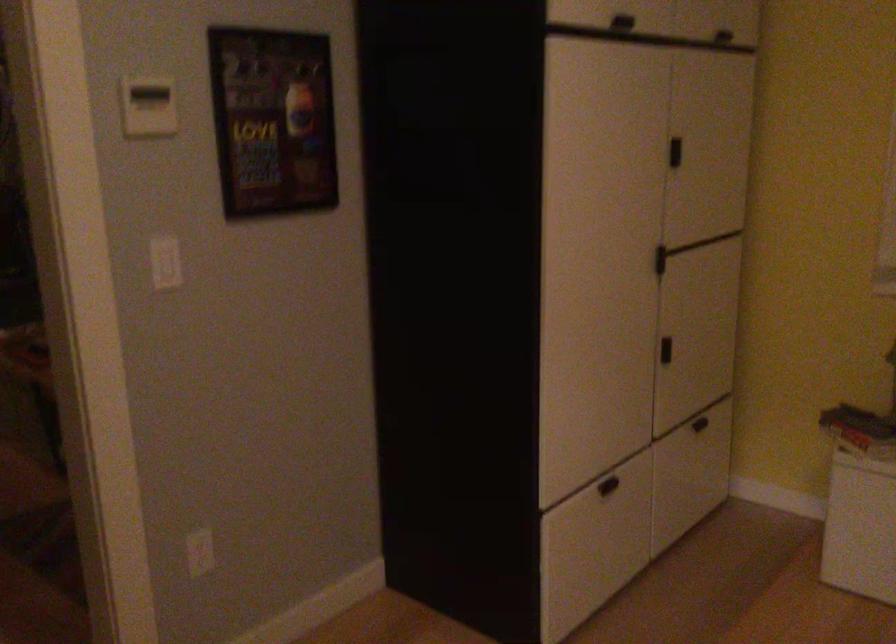
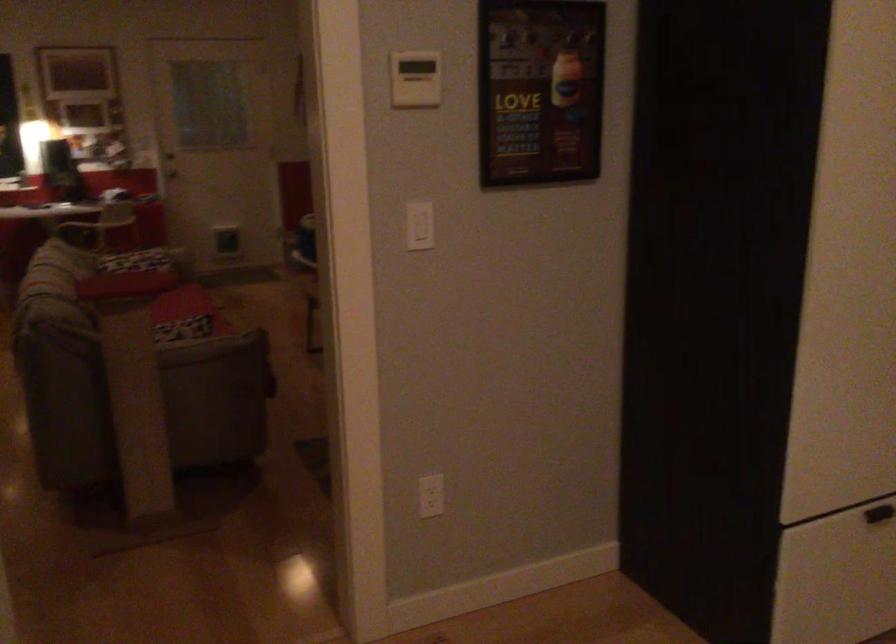
Locate, in the second image, the point that corresponds to (x=608, y=486) in the first image.

(879, 514)